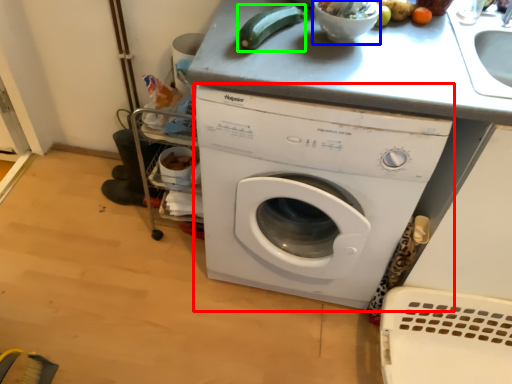
Question: Considering the real-world distances, which object is closest to washing machine (highlighted by a red box)? mixing bowl (highlighted by a blue box) or vegetable (highlighted by a green box).

Choices:
 (A) mixing bowl
 (B) vegetable

Answer: (B)